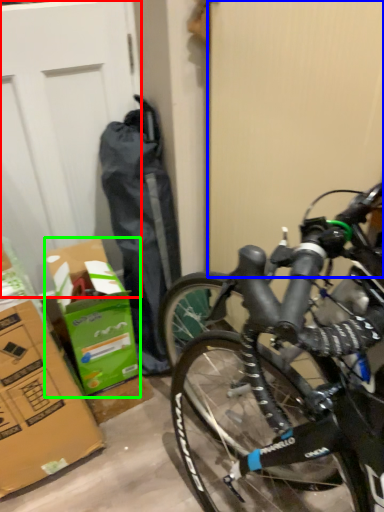
Question: Based on their relative distances, which object is farther from garage door (highlighted by a red box)? Choose from screen door (highlighted by a blue box) and cardboard box (highlighted by a green box).

Choices:
 (A) screen door
 (B) cardboard box

Answer: (A)